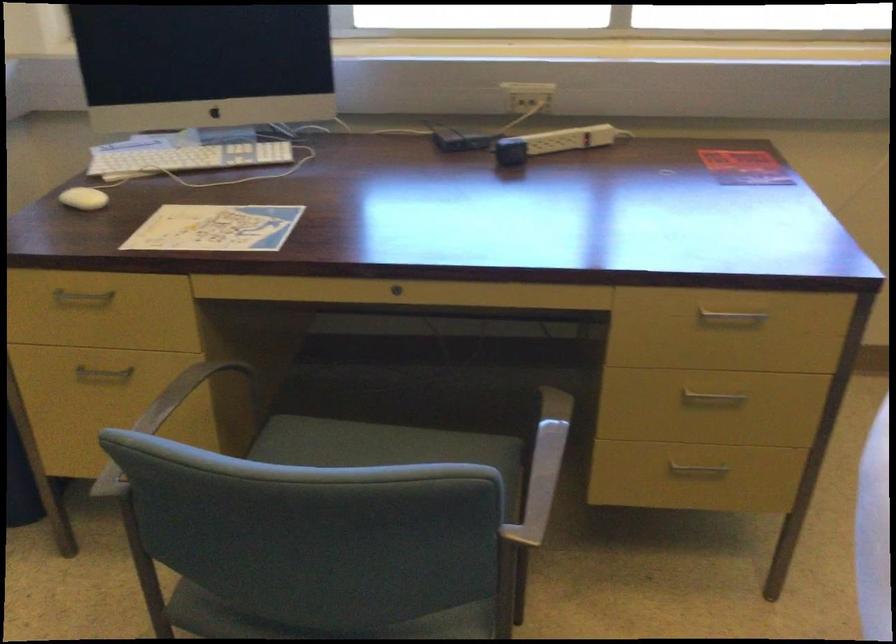
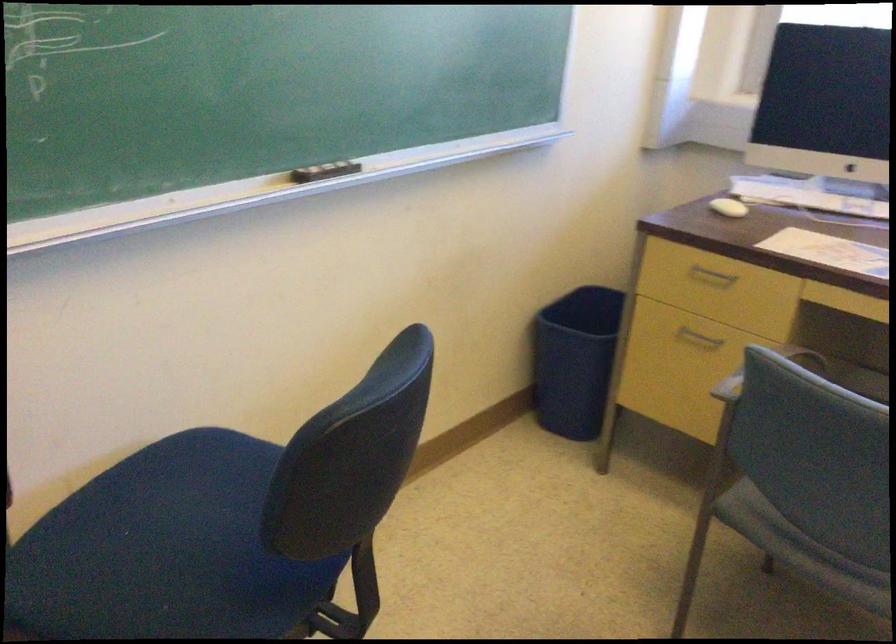
Find the pixel in the second image that matches (x=132, y=466) in the first image.

(764, 371)